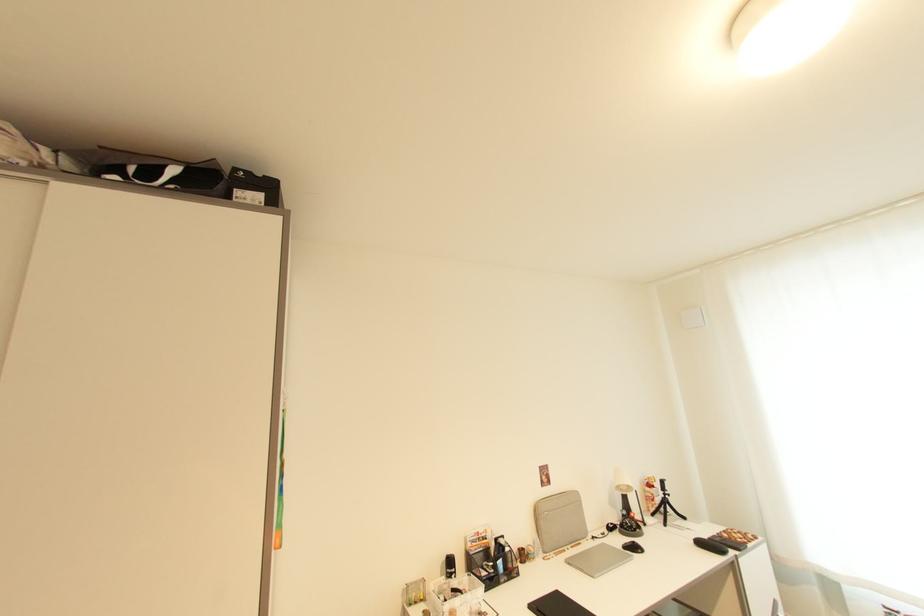
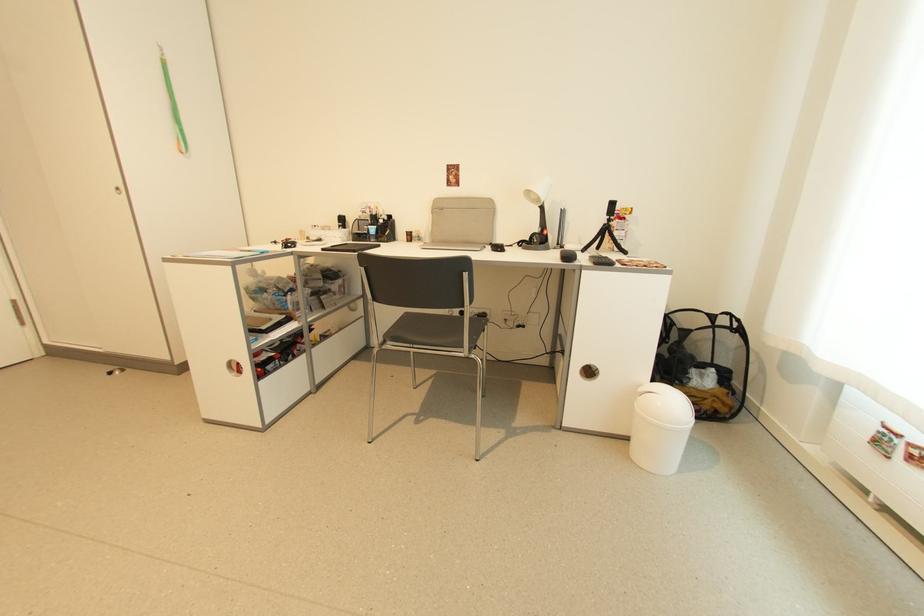
Find the pixel in the second image that matches the point at 667,493 in the first image.

(612, 217)